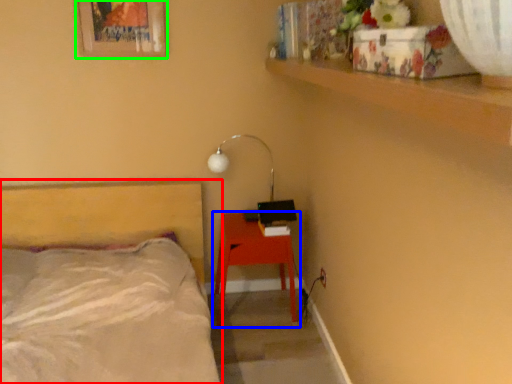
Question: Which object is positioned closest to bed (highlighted by a red box)? Select from nightstand (highlighted by a blue box) and picture frame (highlighted by a green box).

Choices:
 (A) nightstand
 (B) picture frame

Answer: (A)